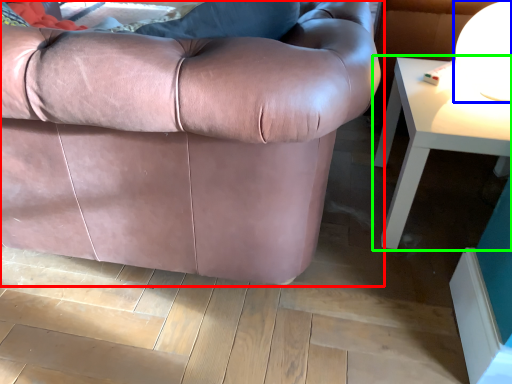
Question: Which object is positioned farthest from studio couch (highlighted by a red box)? Select from table lamp (highlighted by a blue box) and table (highlighted by a green box).

Choices:
 (A) table lamp
 (B) table

Answer: (A)